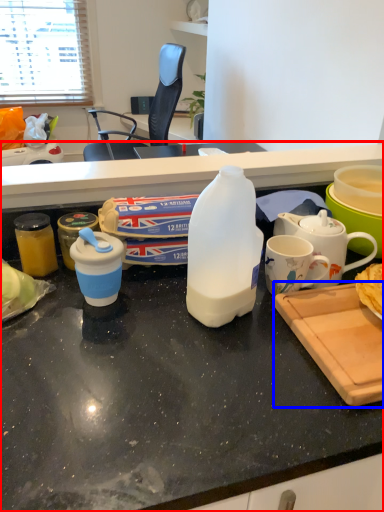
Question: Which point is closer to the camera, desk (highlighted by a red box) or cutting board (highlighted by a blue box)?

Choices:
 (A) desk
 (B) cutting board

Answer: (A)